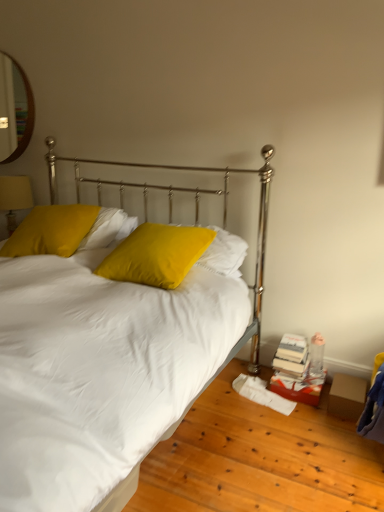
Question: Is matte yellow pillow at center, which is the 2th pillow in left-to-right order, closer to camera compared to wooden framed mirror at upper left?

Choices:
 (A) no
 (B) yes

Answer: (B)

Question: Considering the relative positions of matte yellow pillow at center, which is the 2th pillow in left-to-right order, and wooden framed mirror at upper left in the image provided, is matte yellow pillow at center, which is the 2th pillow in left-to-right order, to the right of wooden framed mirror at upper left from the viewer's perspective?

Choices:
 (A) yes
 (B) no

Answer: (A)

Question: Does matte yellow pillow at center, which is the 2th pillow in left-to-right order, turn towards wooden framed mirror at upper left?

Choices:
 (A) yes
 (B) no

Answer: (B)

Question: Can you confirm if matte yellow pillow at center, placed as the first pillow when sorted from right to left, is positioned to the left of wooden framed mirror at upper left?

Choices:
 (A) yes
 (B) no

Answer: (B)

Question: Considering the relative sizes of matte yellow pillow at center, placed as the first pillow when sorted from right to left, and wooden framed mirror at upper left in the image provided, is matte yellow pillow at center, placed as the first pillow when sorted from right to left, shorter than wooden framed mirror at upper left?

Choices:
 (A) no
 (B) yes

Answer: (B)

Question: From the image's perspective, is matte yellow pillow at center, which is the 2th pillow in left-to-right order, located beneath wooden framed mirror at upper left?

Choices:
 (A) no
 (B) yes

Answer: (B)

Question: Would you say matte yellow pillow at center, placed as the first pillow when sorted from right to left, is outside matte yellow fabric at left?

Choices:
 (A) yes
 (B) no

Answer: (A)

Question: Is matte yellow fabric at left at the back of matte yellow pillow at center, which is the 2th pillow in left-to-right order?

Choices:
 (A) no
 (B) yes

Answer: (A)

Question: Is matte yellow pillow at center, placed as the first pillow when sorted from right to left, wider than matte yellow fabric at left?

Choices:
 (A) yes
 (B) no

Answer: (A)

Question: Is the position of matte yellow pillow at center, placed as the first pillow when sorted from right to left, less distant than that of matte yellow fabric at left?

Choices:
 (A) yes
 (B) no

Answer: (A)

Question: Considering the relative sizes of matte yellow pillow at center, which is the 2th pillow in left-to-right order, and matte yellow fabric at left in the image provided, is matte yellow pillow at center, which is the 2th pillow in left-to-right order, bigger than matte yellow fabric at left?

Choices:
 (A) no
 (B) yes

Answer: (B)

Question: Does matte yellow pillow at center, which is the 2th pillow in left-to-right order, have a lesser width compared to matte yellow fabric at left?

Choices:
 (A) yes
 (B) no

Answer: (B)

Question: Does wooden framed mirror at upper left lie in front of white satin bed at center?

Choices:
 (A) yes
 (B) no

Answer: (B)